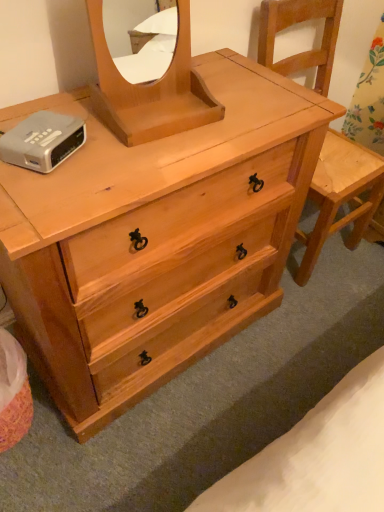
Question: Is silver metallic alarm clock at upper left smaller than natural wood mirror at center?

Choices:
 (A) no
 (B) yes

Answer: (B)

Question: Can you confirm if silver metallic alarm clock at upper left is wider than natural wood mirror at center?

Choices:
 (A) yes
 (B) no

Answer: (B)

Question: From a real-world perspective, is silver metallic alarm clock at upper left located higher than natural wood mirror at center?

Choices:
 (A) yes
 (B) no

Answer: (B)

Question: From the image's perspective, is silver metallic alarm clock at upper left above natural wood mirror at center?

Choices:
 (A) yes
 (B) no

Answer: (B)

Question: Does silver metallic alarm clock at upper left come in front of natural wood mirror at center?

Choices:
 (A) yes
 (B) no

Answer: (B)

Question: Do you think natural wood dresser at center is within silver metallic alarm clock at upper left, or outside of it?

Choices:
 (A) inside
 (B) outside

Answer: (B)

Question: Is natural wood dresser at center in front of or behind silver metallic alarm clock at upper left in the image?

Choices:
 (A) behind
 (B) front

Answer: (B)

Question: Based on their positions, is natural wood dresser at center located to the left or right of silver metallic alarm clock at upper left?

Choices:
 (A) left
 (B) right

Answer: (B)

Question: From a real-world perspective, is natural wood dresser at center positioned above or below silver metallic alarm clock at upper left?

Choices:
 (A) below
 (B) above

Answer: (A)

Question: Considering the positions of point (259, 174) and point (317, 179), is point (259, 174) closer or farther from the camera than point (317, 179)?

Choices:
 (A) closer
 (B) farther

Answer: (A)

Question: From a real-world perspective, is natural wood dresser at center above or below natural wood chair at right?

Choices:
 (A) above
 (B) below

Answer: (B)

Question: Is natural wood dresser at center bigger or smaller than natural wood chair at right?

Choices:
 (A) big
 (B) small

Answer: (A)

Question: Is natural wood dresser at center to the left or to the right of natural wood chair at right in the image?

Choices:
 (A) right
 (B) left

Answer: (B)

Question: Is point (13, 162) positioned closer to the camera than point (177, 59)?

Choices:
 (A) farther
 (B) closer

Answer: (B)

Question: Considering their positions, is silver metallic alarm clock at upper left located in front of or behind natural wood mirror at center?

Choices:
 (A) front
 (B) behind

Answer: (B)